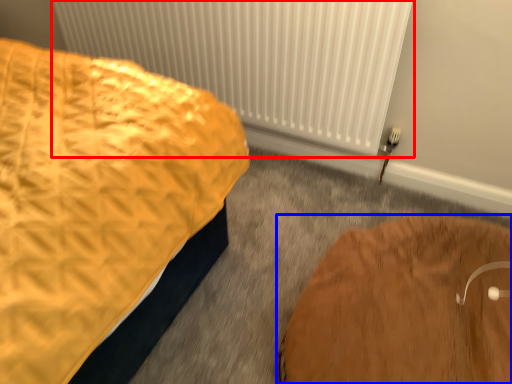
Question: Which object appears closest to the camera in this image, radiator (highlighted by a red box) or furniture (highlighted by a blue box)?

Choices:
 (A) radiator
 (B) furniture

Answer: (B)